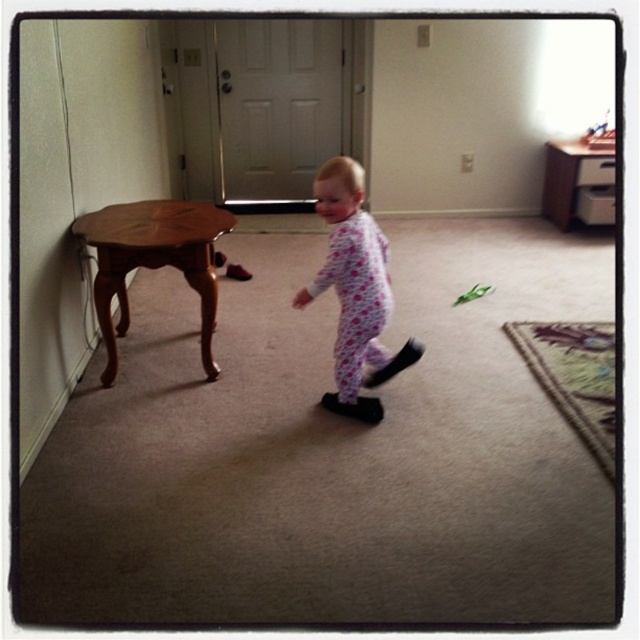
You are a parent trying to decide if your child can sit comfortably on the wooden stool at left while wearing the fluffy pink pajamas at center. Based on the size difference between the two, will the pajamas interfere with sitting?

The fluffy pink pajamas at center has a lesser width compared to wooden stool at left, so the pajamas are narrower than the stool. This means the pajamas should not interfere with sitting comfortably on the wooden stool at left.